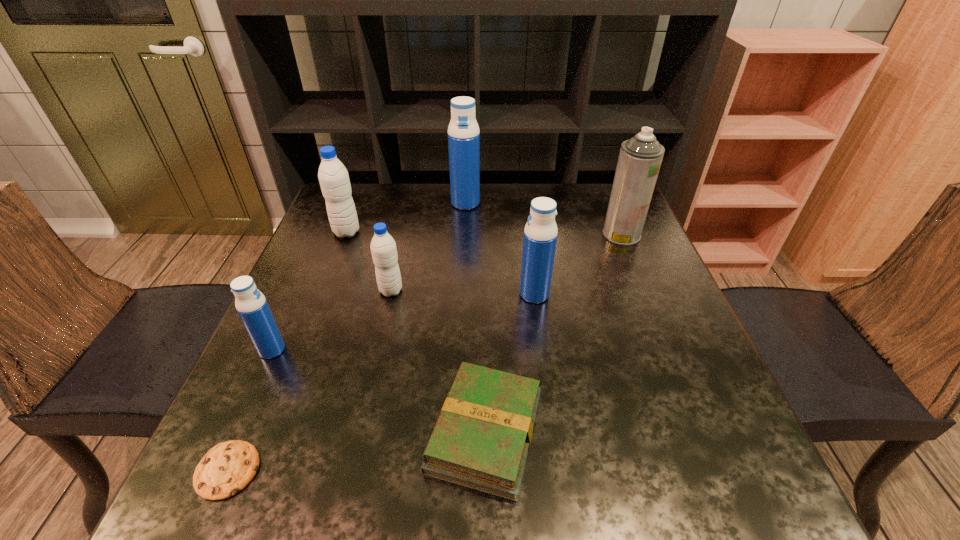
Identify the location of vacant space located 0.140m on the right of the yellow book. (627, 432).

Identify the location of free space located on the right of the shortest object. (367, 470).

Locate an element on the screen. aerosol can that is at the far edge is located at coordinates [x=640, y=158].

You are a GUI agent. You are given a task and a screenshot of the screen. Output one action in this format:
    pyautogui.click(x=<x>, y=<y>)
    Task: Click on the book that is at the near edge
    The width and height of the screenshot is (960, 540).
    Given the screenshot: What is the action you would take?
    pyautogui.click(x=481, y=439)

The width and height of the screenshot is (960, 540). Identify the location of cookie that is positioned at the near edge. (227, 468).

Where is `cookie situated at the left edge`? cookie situated at the left edge is located at coordinates (227, 468).

You are a GUI agent. You are given a task and a screenshot of the screen. Output one action in this format:
    pyautogui.click(x=<x>, y=<y>)
    Task: Click on the object at the right edge
    This screenshot has height=540, width=960.
    Given the screenshot: What is the action you would take?
    pyautogui.click(x=640, y=158)

The width and height of the screenshot is (960, 540). In order to click on object that is at the far left corner in this screenshot , I will do `click(334, 180)`.

Find the location of a particular element. The image size is (960, 540). object that is positioned at the near left corner is located at coordinates pyautogui.click(x=227, y=468).

Locate an element on the screen. Image resolution: width=960 pixels, height=540 pixels. object that is at the far right corner is located at coordinates click(x=640, y=158).